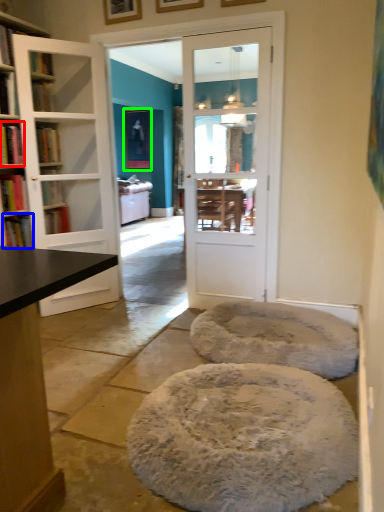
Question: Which object is the closest to the book (highlighted by a red box)? Choose among these: book (highlighted by a blue box) or picture frame (highlighted by a green box).

Choices:
 (A) book
 (B) picture frame

Answer: (A)